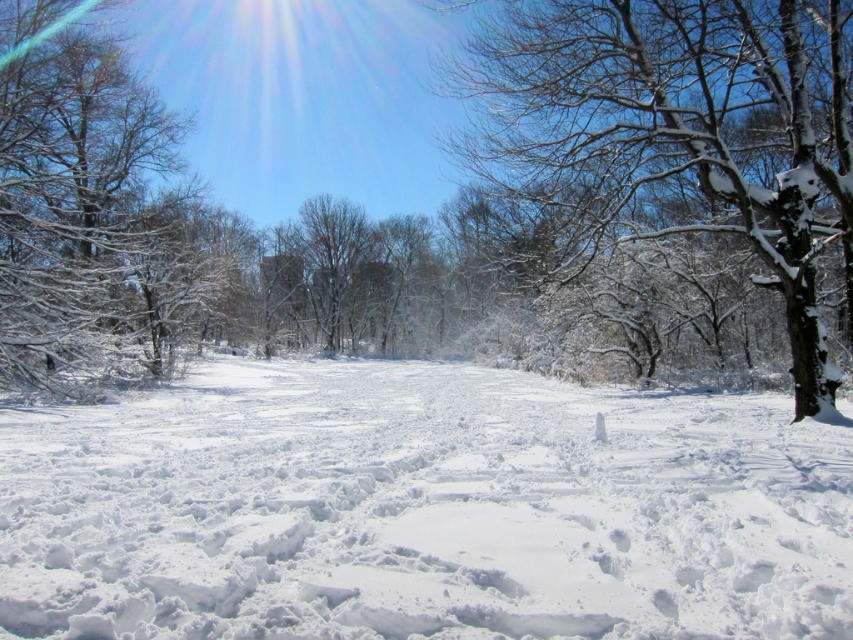
You are standing in the winter landscape and want to place a small red flag exactly at the center of the image. The white fluffy snow at center is located at coordinates 0.797, 0.495. Will the flag be placed on the snow?

Yes, the flag will be placed on the white fluffy snow at center since its coordinates are at the center point of the image.